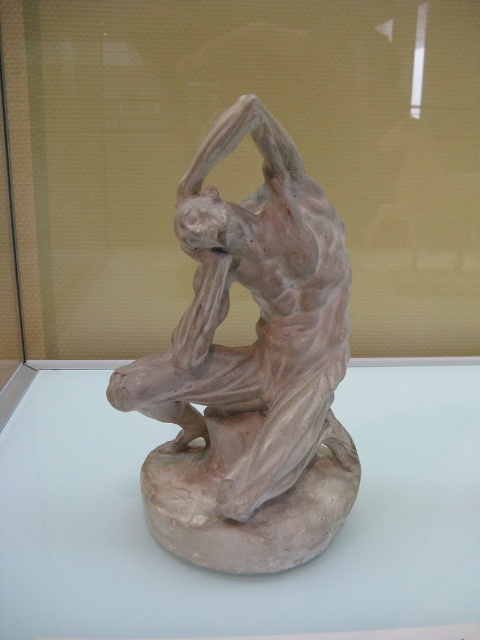
You are an art student analyzing the clay sculpture. You notice two points on the sculpture labeled as point 1 at coordinates (x=466, y=384) and point 2 at (x=289, y=564). Which point is closer to your eyes?

Point 1 at coordinates (x=466, y=384) is closer to the viewer than point 2 at (x=289, y=564).

You are an art curator arranging an exhibition. You need to place a 12.90 inches wide display stand between the matte clay sculpture at center and the matte clay figure at center. Will this display stand fit between them?

The matte clay sculpture at center is 12.90 inches from the matte clay figure at center, so the 12.90 inches wide display stand will exactly fit between them.

You are an art student who needs to place a small label next to the matte clay sculpture at center. The label must be placed at point coordinates of (229, 576). Is the label location correct?

Yes, the label location is correct because the matte clay sculpture at center is exactly at point coordinates of (229, 576).